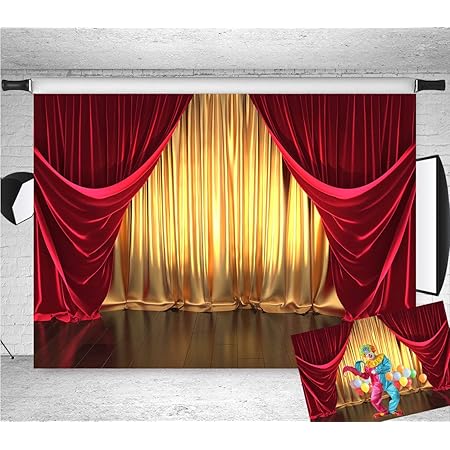
Identify the location of light stand leg. The image size is (450, 450). (6, 346).